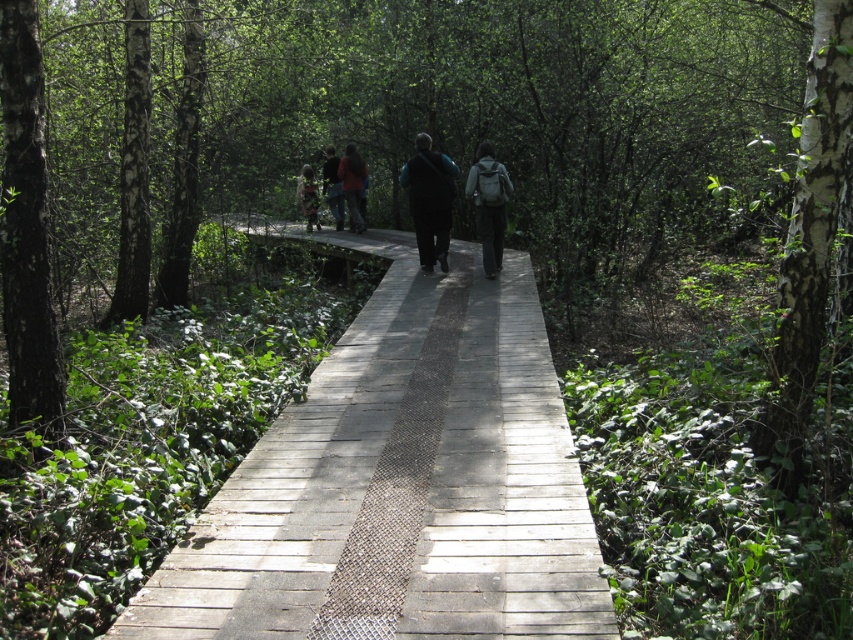
Is point (476, 580) farther from camera compared to point (312, 177)?

That is False.

Can you confirm if wooden boardwalk at center is thinner than camouflage-patterned jacket at center?

Incorrect, wooden boardwalk at center's width is not less than camouflage-patterned jacket at center's.

Is point (424, 372) positioned after point (316, 220)?

That is False.

Locate an element on the screen. wooden boardwalk at center is located at coordinates (401, 483).

Is wooden boardwalk at center taller than dark gray backpack at center?

No.

Between wooden boardwalk at center and dark gray backpack at center, which one appears on the right side from the viewer's perspective?

dark gray backpack at center

Which is behind, point (505, 472) or point (476, 202)?

Point (476, 202)

You are a GUI agent. You are given a task and a screenshot of the screen. Output one action in this format:
    pyautogui.click(x=<x>, y=<y>)
    Task: Click on the wooden boardwalk at center
    
    Given the screenshot: What is the action you would take?
    pyautogui.click(x=401, y=483)

Between dark gray backpack at center and dark blue jacket at center, which one appears on the right side from the viewer's perspective?

From the viewer's perspective, dark gray backpack at center appears more on the right side.

Is point (488, 266) positioned in front of point (340, 176)?

Yes, it is in front of point (340, 176).

You are a GUI agent. You are given a task and a screenshot of the screen. Output one action in this format:
    pyautogui.click(x=<x>, y=<y>)
    Task: Click on the dark gray backpack at center
    
    Given the screenshot: What is the action you would take?
    pyautogui.click(x=488, y=204)